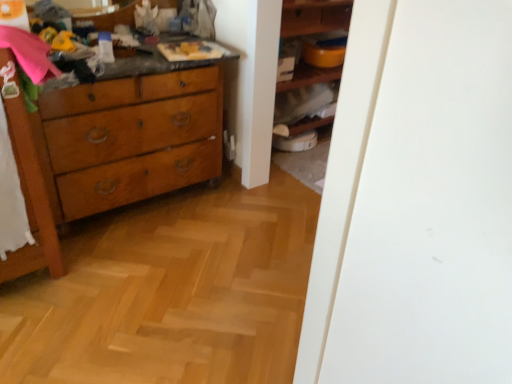
Question: Can you confirm if wooden cabinet at center is shorter than wooden dresser at left?

Choices:
 (A) yes
 (B) no

Answer: (A)

Question: Would you say wooden cabinet at center contains wooden dresser at left?

Choices:
 (A) no
 (B) yes

Answer: (A)

Question: Would you say wooden cabinet at center is outside wooden dresser at left?

Choices:
 (A) yes
 (B) no

Answer: (A)

Question: Does wooden cabinet at center appear on the right side of wooden dresser at left?

Choices:
 (A) yes
 (B) no

Answer: (A)

Question: Is wooden cabinet at center in front of wooden dresser at left?

Choices:
 (A) no
 (B) yes

Answer: (A)

Question: Considering the relative sizes of wooden cabinet at center and wooden dresser at left in the image provided, is wooden cabinet at center wider than wooden dresser at left?

Choices:
 (A) no
 (B) yes

Answer: (A)

Question: Can you confirm if wooden dresser at left is smaller than wooden cabinet at center?

Choices:
 (A) yes
 (B) no

Answer: (B)

Question: Is wooden dresser at left next to wooden cabinet at center and touching it?

Choices:
 (A) no
 (B) yes

Answer: (A)

Question: Does wooden dresser at left have a lesser width compared to wooden cabinet at center?

Choices:
 (A) yes
 (B) no

Answer: (B)

Question: Does wooden dresser at left have a greater width compared to wooden cabinet at center?

Choices:
 (A) yes
 (B) no

Answer: (A)

Question: From the image's perspective, is wooden dresser at left located beneath wooden cabinet at center?

Choices:
 (A) yes
 (B) no

Answer: (A)

Question: Is wooden dresser at left oriented towards wooden cabinet at center?

Choices:
 (A) yes
 (B) no

Answer: (B)

Question: Does wooden shelves at center have a smaller size compared to wooden dresser at left?

Choices:
 (A) yes
 (B) no

Answer: (A)